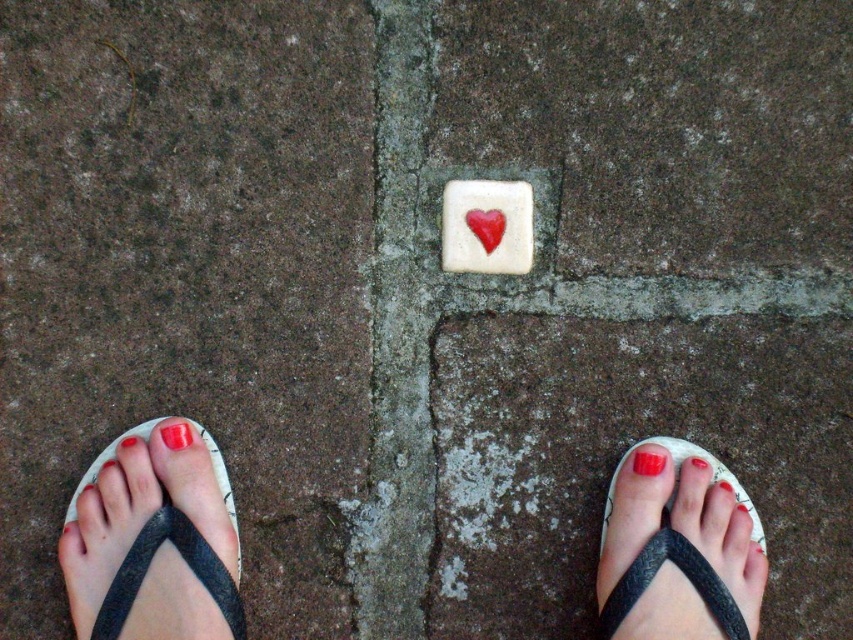
Question: Does matte black flip-flop at lower left have a larger size compared to white matte tile with red heart at center?

Choices:
 (A) yes
 (B) no

Answer: (A)

Question: Observing the image, what is the correct spatial positioning of white matte tile with red heart at center in reference to glossy red nail at center?

Choices:
 (A) above
 (B) below

Answer: (A)

Question: Among these points, which one is farthest from the camera?

Choices:
 (A) (114, 596)
 (B) (643, 500)
 (C) (480, 211)

Answer: (C)

Question: Which of these objects is positioned closest to the glossy red nail at center?

Choices:
 (A) white matte tile with red heart at center
 (B) matte white heart at center

Answer: (A)

Question: From the image, what is the correct spatial relationship of black rubber sandal at lower right in relation to glossy red nail at center?

Choices:
 (A) above
 (B) below

Answer: (B)

Question: Which object is the closest to the black rubber sandal at lower right?

Choices:
 (A) matte red nail at lower left
 (B) matte black flip-flop at lower left
 (C) white matte tile with red heart at center
 (D) matte white heart at center

Answer: (C)